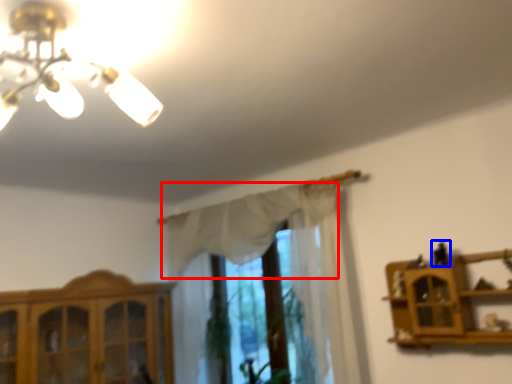
Question: Among these objects, which one is nearest to the camera, curtain (highlighted by a red box) or toy (highlighted by a blue box)?

Choices:
 (A) curtain
 (B) toy

Answer: (B)